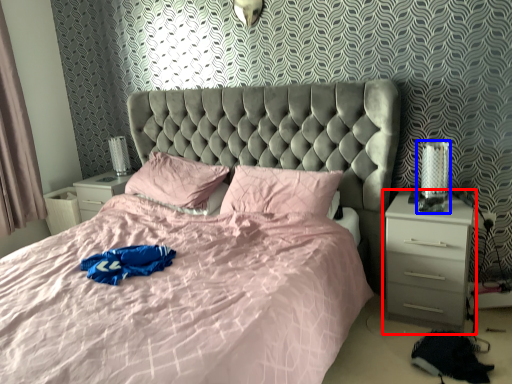
Question: Which object appears closest to the camera in this image, nightstand (highlighted by a red box) or table lamp (highlighted by a blue box)?

Choices:
 (A) nightstand
 (B) table lamp

Answer: (A)